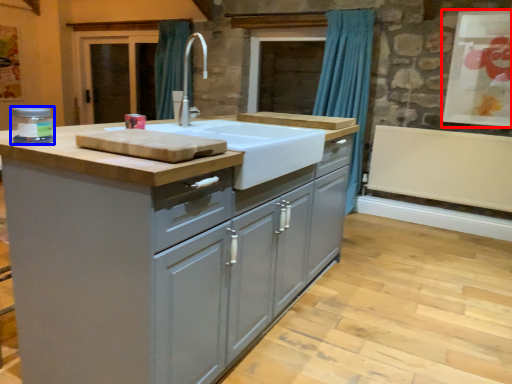
Question: Which object is closer to the camera taking this photo, window screen (highlighted by a red box) or appliance (highlighted by a blue box)?

Choices:
 (A) window screen
 (B) appliance

Answer: (B)